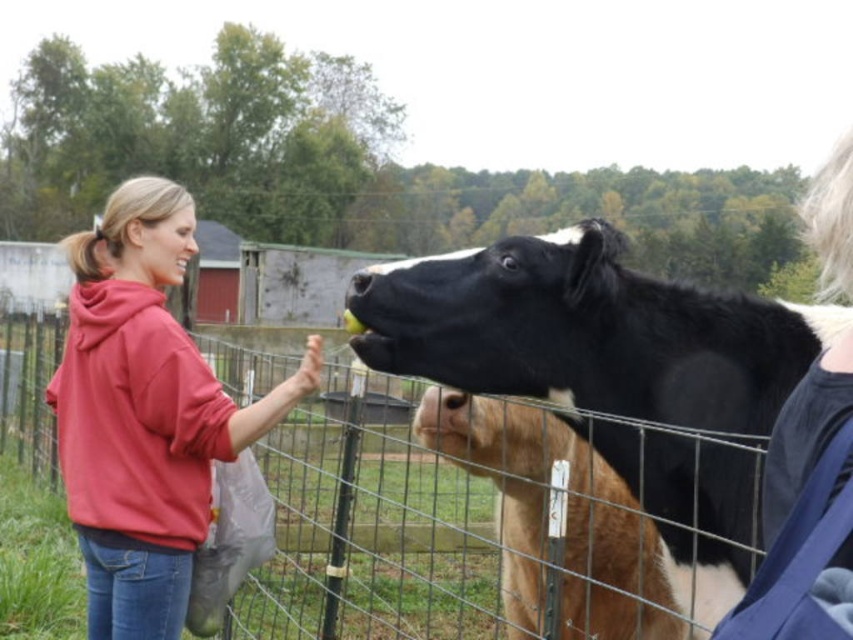
You are a farmer who needs to separate the black glossy cow at upper center and the brown furry calf at center into two pens based on their size. Which animal should go into the larger pen?

The black glossy cow at upper center is larger in size than the brown furry calf at center, so it should go into the larger pen.

In the scene shown: You are a visitor at the farm and want to take a photo of the black glossy cow at upper center and the brown furry calf at center. Which animal should you focus on first to ensure both are in the frame?

You should focus on the black glossy cow at upper center first because it is in front of the brown furry calf at center, so it will be closer to the camera and easier to frame both animals together.